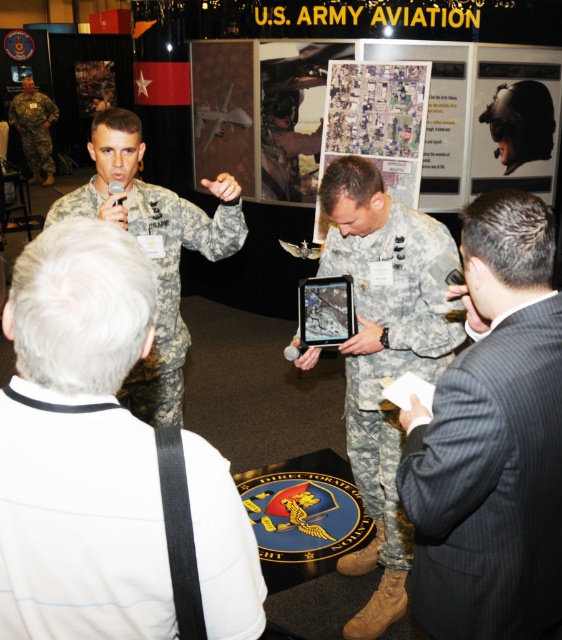
Can you confirm if camouflage fabric uniform at center is thinner than camouflage fabric uniform at left?

Yes.

Is camouflage fabric uniform at center wider than camouflage fabric uniform at left?

No.

Does point (328, 262) lie behind point (20, 124)?

No, (328, 262) is closer to viewer.

The width and height of the screenshot is (562, 640). I want to click on camouflage fabric uniform at center, so click(x=391, y=340).

Is the position of camouflage uniform at left more distant than that of camouflage fabric uniform at left?

No, camouflage uniform at left is closer to the viewer.

Is camouflage uniform at left to the right of camouflage fabric uniform at left from the viewer's perspective?

Correct, you'll find camouflage uniform at left to the right of camouflage fabric uniform at left.

Between point (151, 211) and point (33, 120), which one is positioned in front?

Positioned in front is point (151, 211).

Where is `camouflage uniform at left`? camouflage uniform at left is located at coordinates (153, 250).

Based on the photo, who is shorter, black pinstripe suit at right or camouflage uniform at left?

black pinstripe suit at right

Which is more to the right, black pinstripe suit at right or camouflage uniform at left?

black pinstripe suit at right is more to the right.

Does point (531, 312) lie behind point (167, 323)?

That is False.

Find the location of `black pinstripe suit at right`. black pinstripe suit at right is located at coordinates (491, 484).